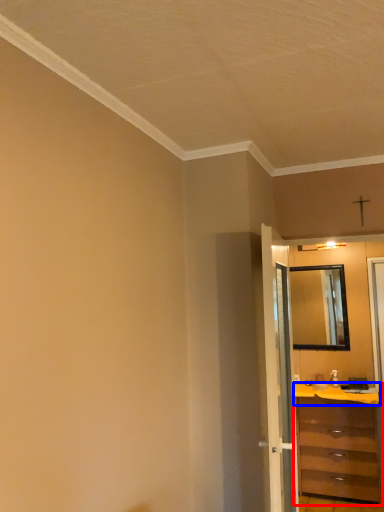
Question: Among these objects, which one is nearest to the camera, chest of drawers (highlighted by a red box) or counter top (highlighted by a blue box)?

Choices:
 (A) chest of drawers
 (B) counter top

Answer: (A)